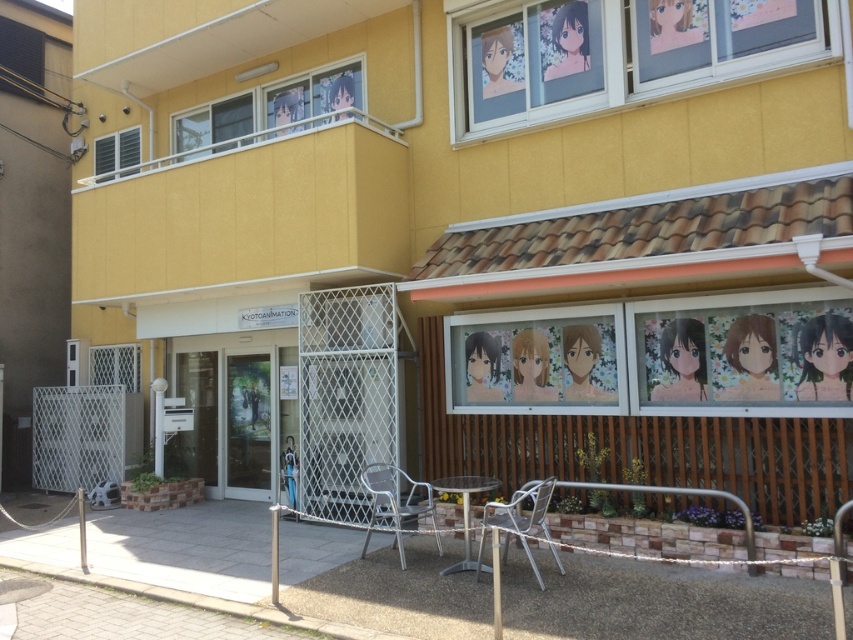
You are standing in front of the building and want to take a photo. You notice two points marked in the image. Which point is closer to you, point (428, 490) or point (505, 556)?

Point (505, 556) is closer to you because it is less further to the camera than point (428, 490).

Looking at this image, you are sitting at the silver metallic chair at center and want to move to the metallic silver chair at lower center. Can you walk directly forward without changing direction?

The metallic silver chair at lower center is behind the silver metallic chair at center, so yes, you can walk directly forward without changing direction to reach it.

You are standing at point 0.5,0.5 in the image. You want to move to the silver metallic chair at center. Which direction should you move in?

You should move towards the right and slightly upwards to reach the silver metallic chair at center located at point (395, 502) from your current position at (426, 320).